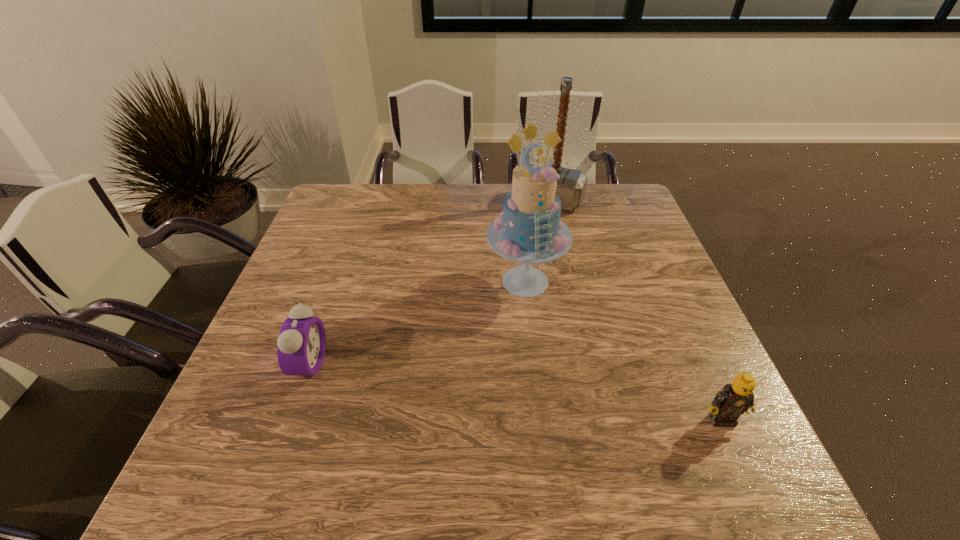
Identify the location of vacant space located 0.280m on the striking surface of the hammer. The width and height of the screenshot is (960, 540). (510, 267).

Find the location of a particular element. The width and height of the screenshot is (960, 540). vacant region located 0.240m on the striking surface of the hammer is located at coordinates (516, 259).

The image size is (960, 540). Identify the location of free region located 0.160m on the striking surface of the hammer. (525, 242).

Find the location of a particular element. This screenshot has width=960, height=540. object positioned at the far edge is located at coordinates (571, 186).

Identify the location of object present at the near edge. The width and height of the screenshot is (960, 540). (734, 399).

This screenshot has width=960, height=540. What are the coordinates of `object that is at the left edge` in the screenshot? It's located at (301, 344).

Locate an element on the screen. This screenshot has width=960, height=540. object that is at the right edge is located at coordinates (734, 399).

Locate an element on the screen. object located in the near right corner section of the desktop is located at coordinates (734, 399).

In the image, there is a desktop. Where is `vacant space at the far edge`? The image size is (960, 540). vacant space at the far edge is located at coordinates (425, 212).

The width and height of the screenshot is (960, 540). What are the coordinates of `vacant space at the near edge` in the screenshot? It's located at (613, 438).